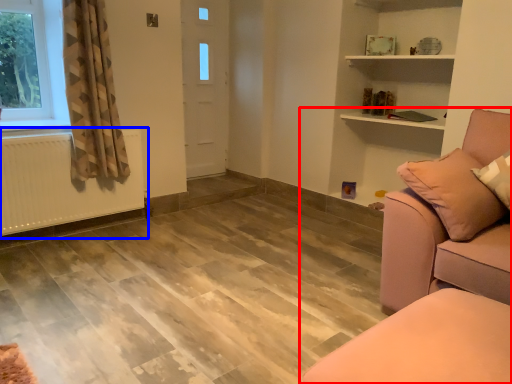
Question: Which object is further to the camera taking this photo, studio couch (highlighted by a red box) or radiator (highlighted by a blue box)?

Choices:
 (A) studio couch
 (B) radiator

Answer: (B)